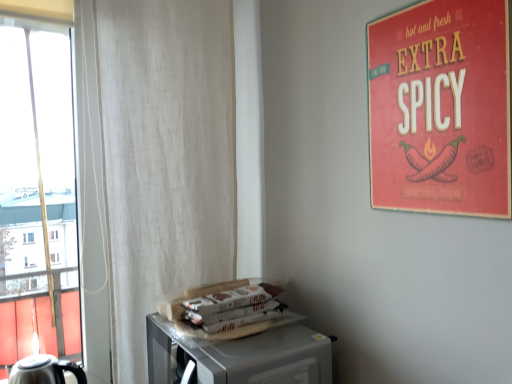
Question: Can you confirm if red matte poster at upper right is positioned to the right of metallic microwave at lower right?

Choices:
 (A) no
 (B) yes

Answer: (B)

Question: Could you tell me if red matte poster at upper right is facing metallic microwave at lower right?

Choices:
 (A) no
 (B) yes

Answer: (A)

Question: Are red matte poster at upper right and metallic microwave at lower right far apart?

Choices:
 (A) yes
 (B) no

Answer: (B)

Question: Is red matte poster at upper right outside metallic microwave at lower right?

Choices:
 (A) no
 (B) yes

Answer: (B)

Question: Can you confirm if red matte poster at upper right is shorter than metallic microwave at lower right?

Choices:
 (A) no
 (B) yes

Answer: (A)

Question: From the image's perspective, relative to red matte poster at upper right, is white paper magazine at lower center above or below?

Choices:
 (A) below
 (B) above

Answer: (A)

Question: From a real-world perspective, is white paper magazine at lower center above or below red matte poster at upper right?

Choices:
 (A) above
 (B) below

Answer: (B)

Question: Based on their sizes in the image, would you say white paper magazine at lower center is bigger or smaller than red matte poster at upper right?

Choices:
 (A) big
 (B) small

Answer: (B)

Question: From their relative heights in the image, would you say white paper magazine at lower center is taller or shorter than red matte poster at upper right?

Choices:
 (A) tall
 (B) short

Answer: (B)

Question: Is metallic microwave at lower right wider or thinner than stainless steel kettle at lower left?

Choices:
 (A) wide
 (B) thin

Answer: (A)

Question: Is metallic microwave at lower right situated inside stainless steel kettle at lower left or outside?

Choices:
 (A) outside
 (B) inside

Answer: (A)

Question: Considering the positions of point (264, 382) and point (36, 362), is point (264, 382) closer or farther from the camera than point (36, 362)?

Choices:
 (A) closer
 (B) farther

Answer: (A)

Question: In the image, is metallic microwave at lower right positioned in front of or behind stainless steel kettle at lower left?

Choices:
 (A) front
 (B) behind

Answer: (A)

Question: From a real-world perspective, is stainless steel kettle at lower left physically located above or below metallic microwave at lower right?

Choices:
 (A) above
 (B) below

Answer: (B)

Question: Considering the positions of stainless steel kettle at lower left and metallic microwave at lower right in the image, is stainless steel kettle at lower left bigger or smaller than metallic microwave at lower right?

Choices:
 (A) big
 (B) small

Answer: (B)